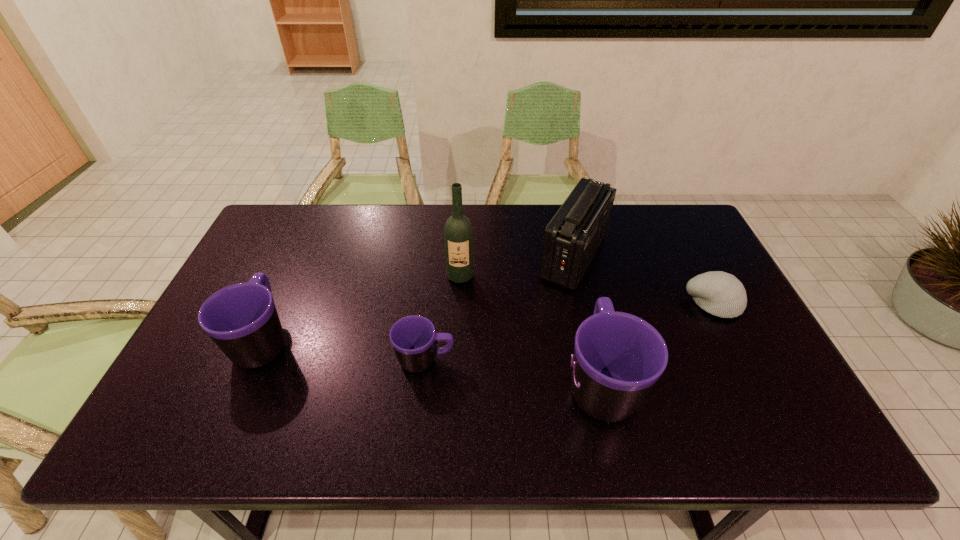
The width and height of the screenshot is (960, 540). Identify the location of the leftmost object. (242, 320).

Identify the location of the fourth tallest object. Image resolution: width=960 pixels, height=540 pixels. (242, 320).

The image size is (960, 540). I want to click on the shortest mug, so click(414, 339).

The width and height of the screenshot is (960, 540). Find the location of `the rightmost mug`. the rightmost mug is located at coordinates (618, 357).

The image size is (960, 540). Identify the location of radio receiver. (572, 237).

At what (x,y) coordinates should I click in order to perform the action: click on the tallest object. Please return your answer as a coordinate pair (x, y). Looking at the image, I should click on 458,234.

Identify the location of beanie. The image size is (960, 540). (721, 294).

Where is `vacant space located with the handle on the side of the leftmost mug`? The height and width of the screenshot is (540, 960). vacant space located with the handle on the side of the leftmost mug is located at coordinates (310, 237).

Locate an element on the screen. vacant space situated 0.380m with the handle on the side of the leftmost mug is located at coordinates (315, 226).

Locate an element on the screen. The width and height of the screenshot is (960, 540). vacant region located 0.400m with the handle on the side of the leftmost mug is located at coordinates click(316, 222).